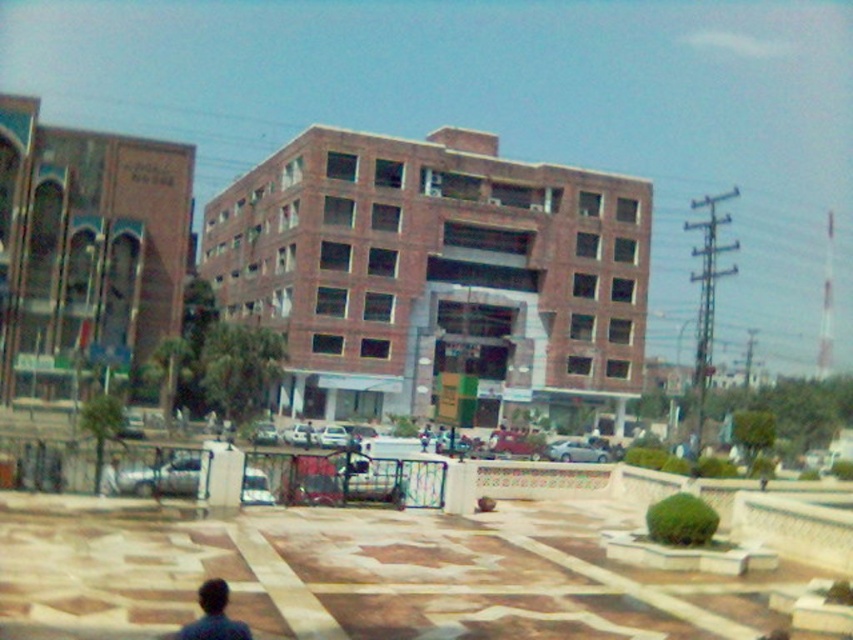
Is brick building at center thinner than dark blue fabric at lower left?

Incorrect, brick building at center's width is not less than dark blue fabric at lower left's.

Locate an element on the screen. brick building at center is located at coordinates (434, 275).

Where is `brick building at center`? brick building at center is located at coordinates (434, 275).